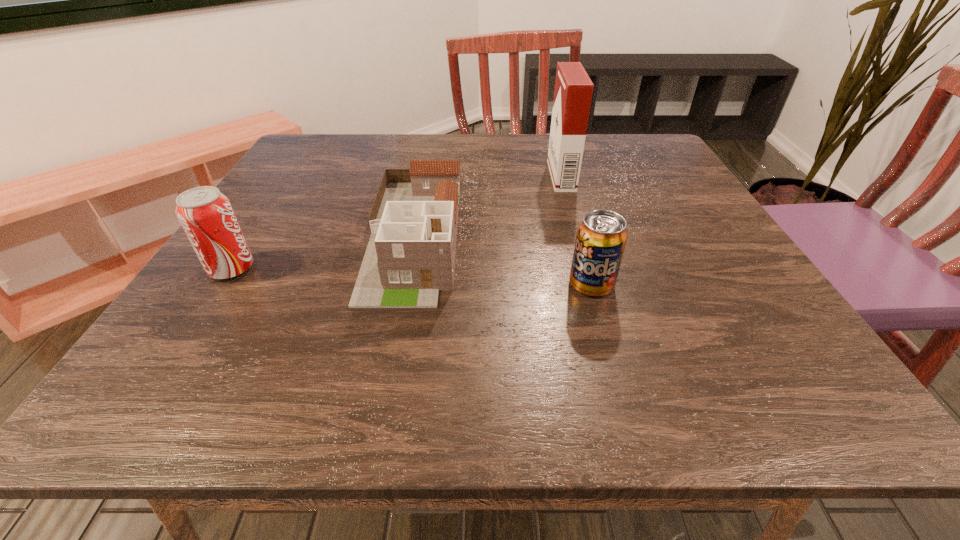
I want to click on unoccupied area between the cigarette_case and the dollhouse, so click(x=488, y=205).

At what (x,y) coordinates should I click in order to perform the action: click on free space that is in between the right soda can and the dollhouse. Please return your answer as a coordinate pair (x, y). The width and height of the screenshot is (960, 540). Looking at the image, I should click on [503, 260].

Find the location of a particular element. free spot between the tallest object and the shorter soda can is located at coordinates (576, 230).

Identify the location of free space that is in between the dollhouse and the left soda can. The height and width of the screenshot is (540, 960). (324, 252).

Identify which object is the third closest to the shorter soda can. Please provide its 2D coordinates. Your answer should be formatted as a tuple, i.e. [(x, y)], where the tuple contains the x and y coordinates of a point satisfying the conditions above.

[(206, 215)]

Point out which object is positioned as the third nearest to the left soda can. Please provide its 2D coordinates. Your answer should be formatted as a tuple, i.e. [(x, y)], where the tuple contains the x and y coordinates of a point satisfying the conditions above.

[(573, 91)]

At what (x,y) coordinates should I click in order to perform the action: click on free space in the image that satisfies the following two spatial constraints: 1. on the logo side of the left soda can; 2. on the back side of the right soda can. Please return your answer as a coordinate pair (x, y). The image size is (960, 540). Looking at the image, I should click on pyautogui.click(x=222, y=285).

Image resolution: width=960 pixels, height=540 pixels. In order to click on blank area in the image that satisfies the following two spatial constraints: 1. on the front-facing side of the cigarette_case; 2. on the front side of the right soda can in this screenshot , I will do pyautogui.click(x=592, y=285).

You are a GUI agent. You are given a task and a screenshot of the screen. Output one action in this format:
    pyautogui.click(x=<x>, y=<y>)
    Task: Click on the vacant space that satisfies the following two spatial constraints: 1. at the main entrance of the dollhouse; 2. on the right side of the shorter soda can
    The image size is (960, 540).
    Given the screenshot: What is the action you would take?
    pyautogui.click(x=405, y=285)

This screenshot has width=960, height=540. Find the location of `free space in the image that satisfies the following two spatial constraints: 1. at the main entrance of the third object from right to left; 2. on the right side of the right soda can`. free space in the image that satisfies the following two spatial constraints: 1. at the main entrance of the third object from right to left; 2. on the right side of the right soda can is located at coordinates (405, 285).